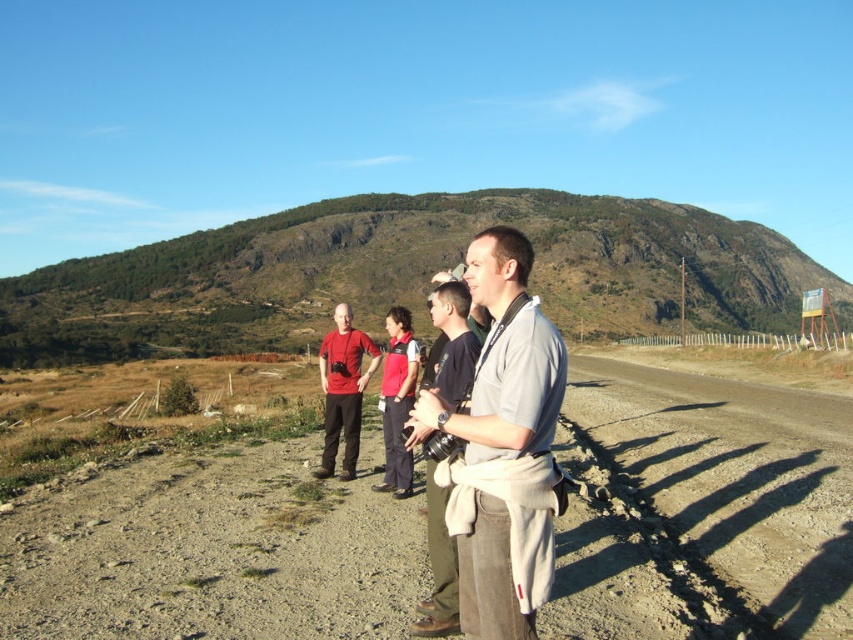
You are standing at the point labeled point (728, 483) and want to walk to the point labeled point (354, 419). Given that the terrain between them is uneven and covered with patches of grass and dirt, how many steps do you think it would take you to reach the destination?

The question cannot be answered with the provided information because the distance between the points isn

You are planning to drive a car that is 1.8 meters wide through the path. Based on the scene, can the car pass through the dirt track at center or the dirt road at lower right?

The dirt track at center is wider than the dirt road at lower right. Since the car is 1.8 meters wide, the dirt track at center would be suitable for passage as it has sufficient width. The dirt road at lower right is narrower and may not accommodate the car comfortably.